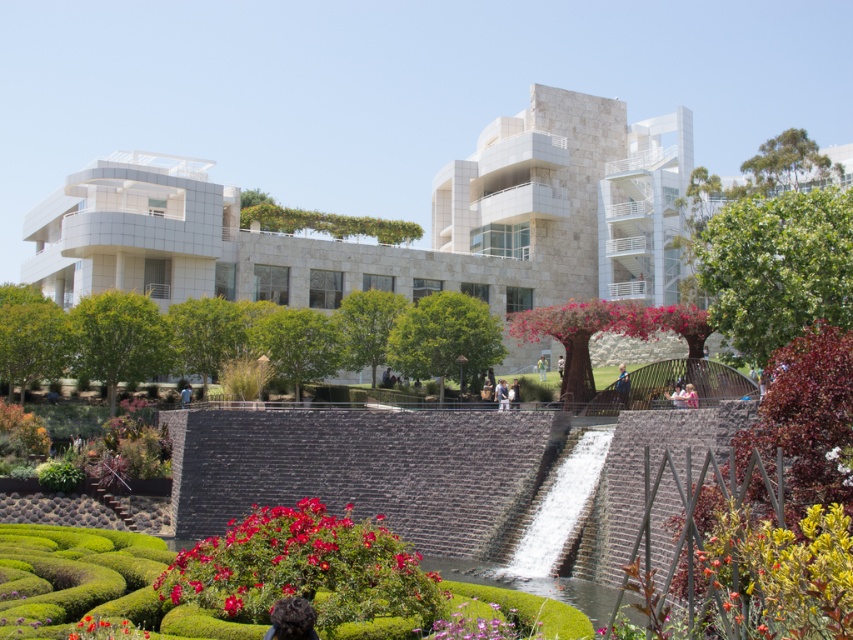
Is green leafy hedge at right bigger than green leafy hedge at center?

Yes.

Does green leafy hedge at right have a greater width compared to green leafy hedge at center?

No, green leafy hedge at right is not wider than green leafy hedge at center.

I want to click on green leafy hedge at right, so click(x=776, y=266).

Can you confirm if green leafy hedge at right is smaller than yellow-green succulent at lower right?

Incorrect, green leafy hedge at right is not smaller in size than yellow-green succulent at lower right.

Is point (730, 266) positioned in front of point (723, 561)?

That is False.

Where is `green leafy hedge at right`? The height and width of the screenshot is (640, 853). green leafy hedge at right is located at coordinates (776, 266).

Is vivid red petals at center taller than green leafy hedge at center?

In fact, vivid red petals at center may be shorter than green leafy hedge at center.

Who is higher up, vivid red petals at center or green leafy hedge at center?

green leafy hedge at center

Is point (236, 525) less distant than point (305, 224)?

Yes, point (236, 525) is closer to viewer.

Find the location of a particular element. vivid red petals at center is located at coordinates (300, 566).